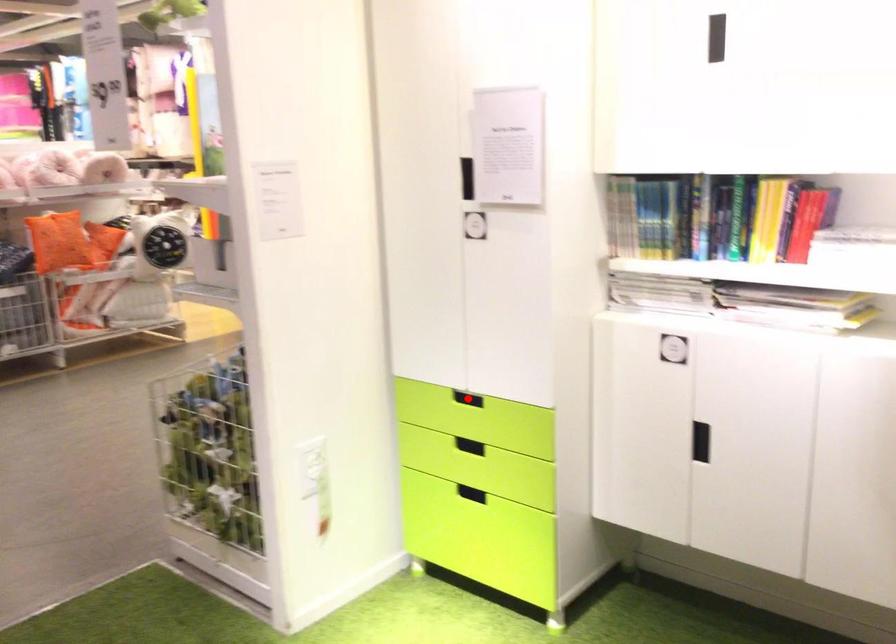
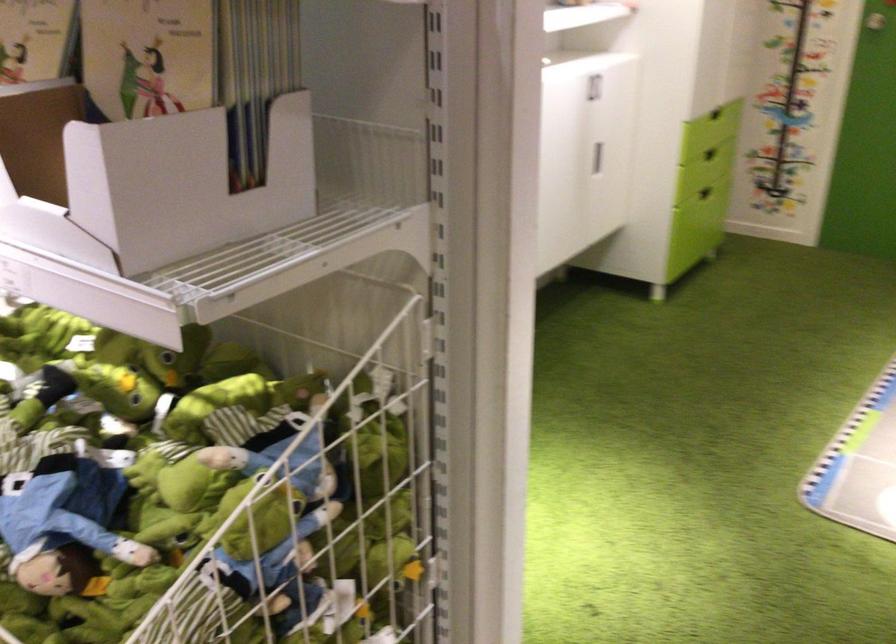
Question: I am providing you with two images of the same scene from different viewpoints. A red point is marked on the first image. Is the red point's position out of view in image 2?

Choices:
 (A) Yes
 (B) No

Answer: (A)